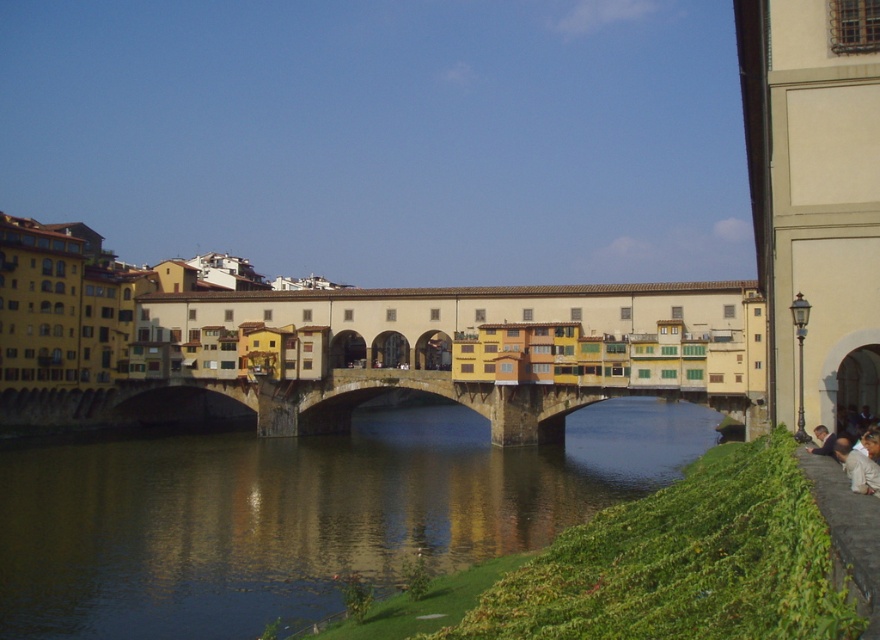
You are standing on the riverbank and see the stone bridge at center and the white fabric at lower right. Which object is closer to your left side?

The stone bridge at center is closer to your left side because it is positioned to the left of the white fabric at lower right.

You are standing on the Ponte Vecchio bridge and want to take a photo of the green grassy bank at lower right. Which direction should you point your camera to capture it?

The green grassy bank at lower right is located at point coordinates of (299, 513), so you should point your camera towards the lower right direction to capture it.